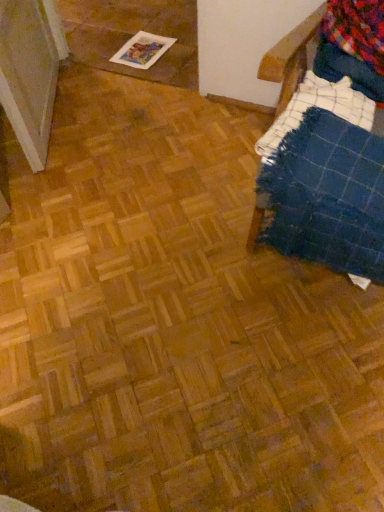
You are a GUI agent. You are given a task and a screenshot of the screen. Output one action in this format:
    pyautogui.click(x=<x>, y=<y>)
    Task: Click on the vacant space situated on the left part of blue plaid blanket at right
    
    Given the screenshot: What is the action you would take?
    pyautogui.click(x=187, y=208)